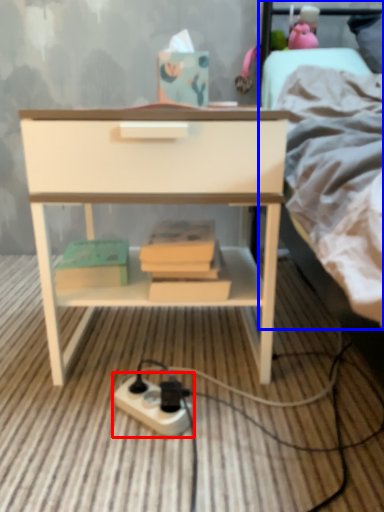
Question: Which object appears farthest to the camera in this image, power plugs and sockets (highlighted by a red box) or bed (highlighted by a blue box)?

Choices:
 (A) power plugs and sockets
 (B) bed

Answer: (B)